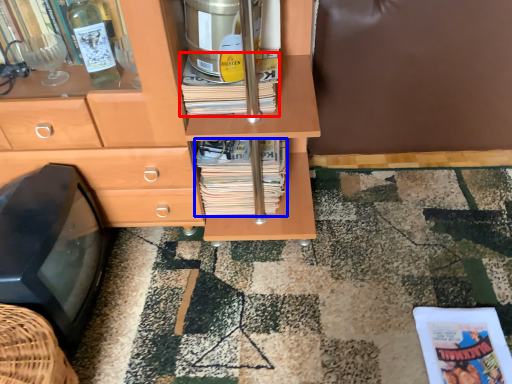
Question: Among these objects, which one is nearest to the camera, book (highlighted by a red box) or magazine (highlighted by a blue box)?

Choices:
 (A) book
 (B) magazine

Answer: (A)